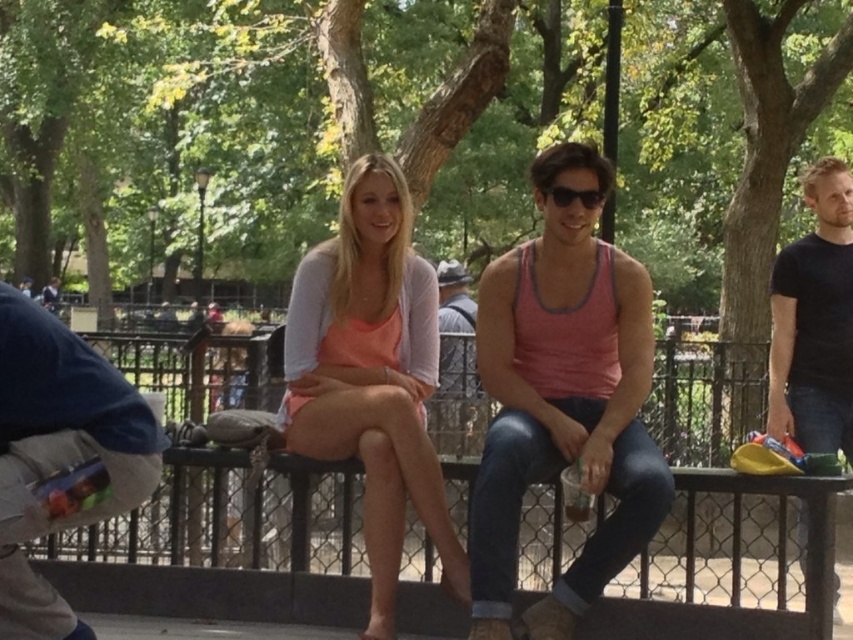
Question: Does striped fabric shirt at center come behind sunglasses at center?

Choices:
 (A) no
 (B) yes

Answer: (B)

Question: Among these objects, which one is farthest from the camera?

Choices:
 (A) pink fabric tank top at center
 (B) blue denim jacket at left

Answer: (A)

Question: Which point is closer to the camera?

Choices:
 (A) sunglasses at center
 (B) dark blue t-shirt at right
 (C) black metal fence at center

Answer: (C)

Question: Among these objects, which one is nearest to the camera?

Choices:
 (A) dark blue t-shirt at right
 (B) blue denim jacket at left

Answer: (B)

Question: Can you confirm if matte peach tank top at center is wider than sunglasses at center?

Choices:
 (A) yes
 (B) no

Answer: (A)

Question: Considering the relative positions of matte peach tank top at center and blue denim jacket at left in the image provided, where is matte peach tank top at center located with respect to blue denim jacket at left?

Choices:
 (A) left
 (B) right

Answer: (B)